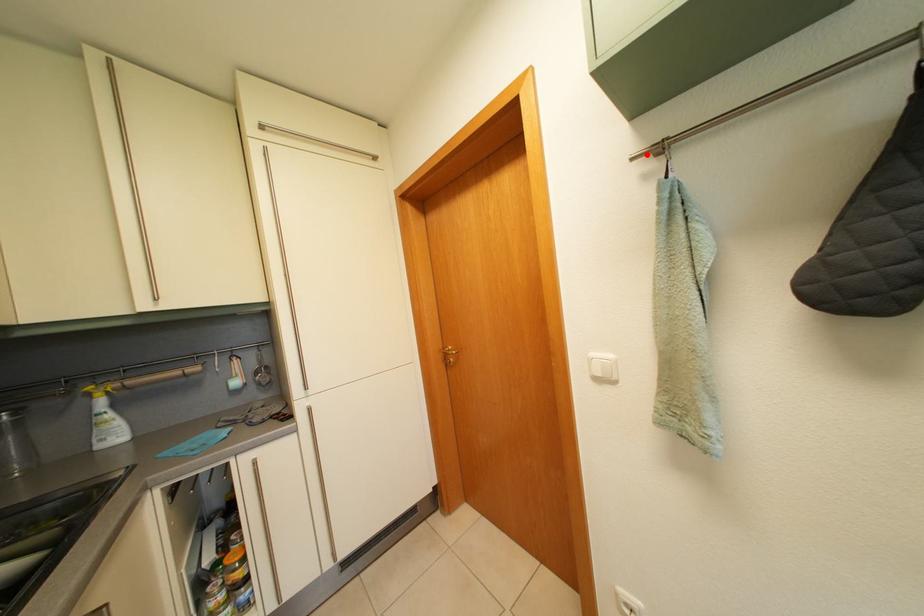
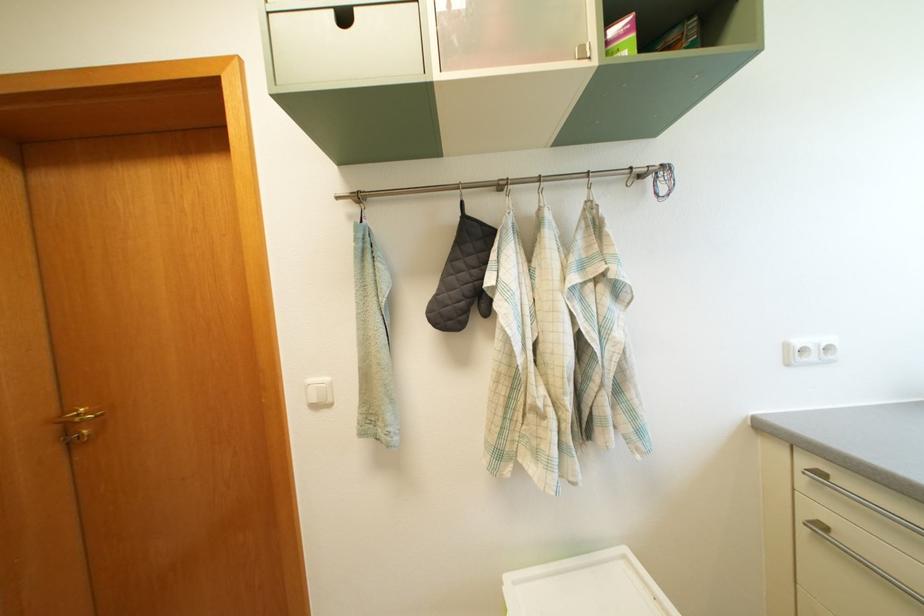
Locate, in the second image, the point that corresponds to the highlighted location in the first image.

(350, 197)